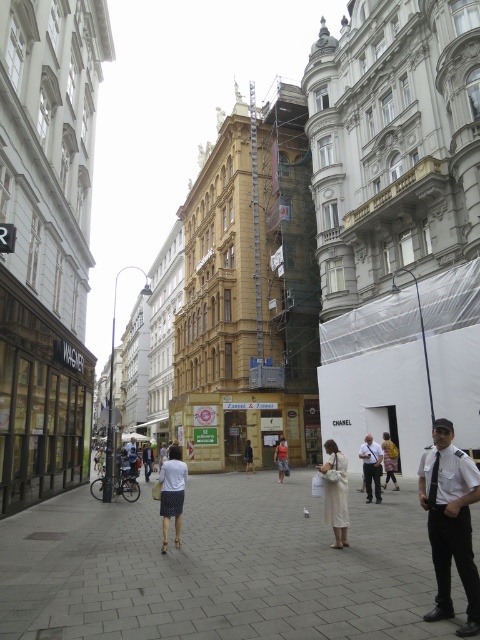
Based on the photo, you are a delivery person who needs to place a package on the ground near the light beige fabric bag at center. If the package is 0.5 meters in diameter, will it fit without overlapping the bag?

The light beige fabric bag at center is located at point (389, 460). Since the package is 0.5 meters in diameter, it can be placed near the bag as long as there is enough space around the specified coordinates to accommodate its size without overlapping. However, without additional spatial information about the surrounding area, it is impossible to determine with certainty.

You are a photographer standing on the street and want to take a photo of both the white cotton dress at center and the white cotton shirt at center. However, you notice that one is blocking the other. Which one is in front and needs to be positioned differently to ensure both are fully visible?

The white cotton dress at center is in front of the white cotton shirt at center, so you should move the dress to the side to allow the shirt to be fully visible.